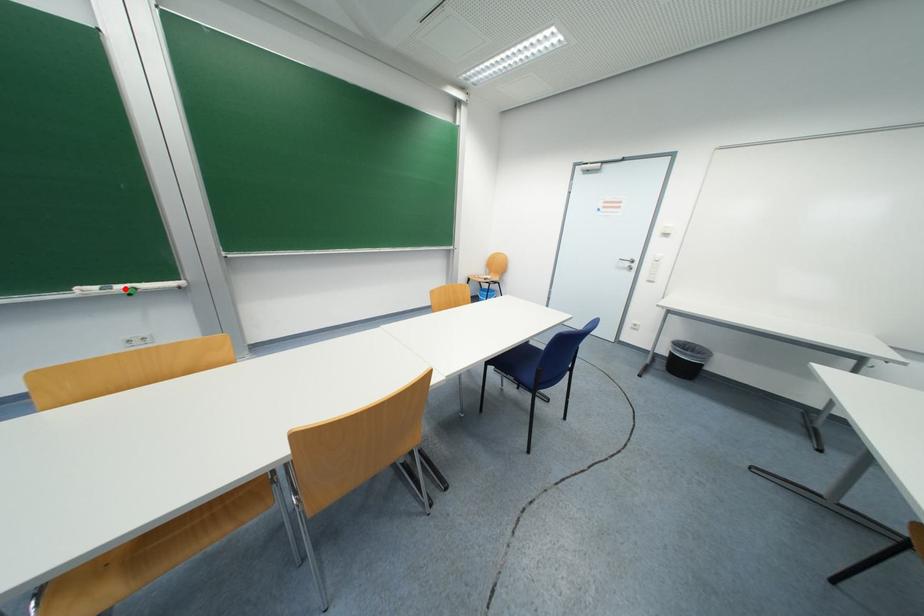
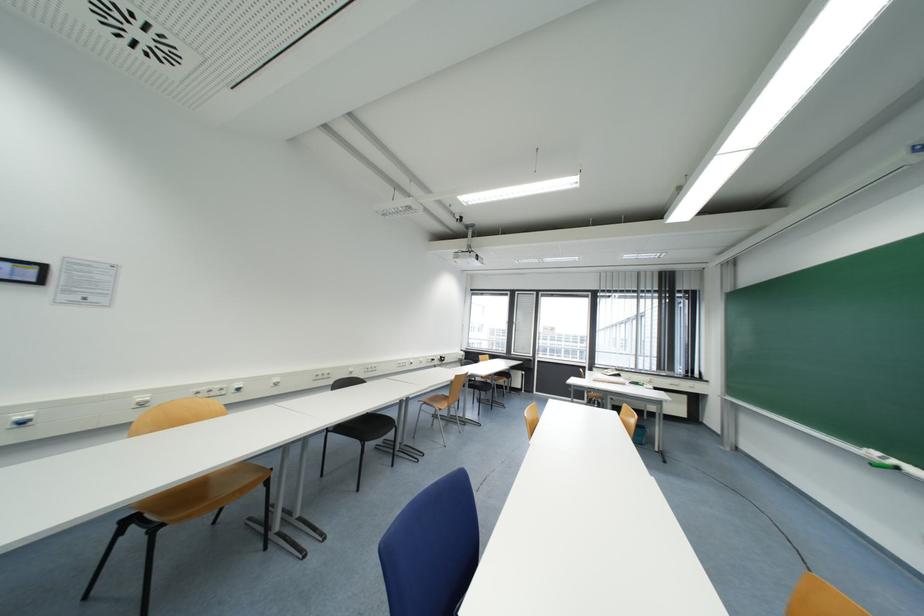
Question: I am providing you with two images of the same scene from different viewpoints. In image1, a red point is highlighted. Considering the same 3D point in image2, which of the following is correct?

Choices:
 (A) It is closer
 (B) It is farther

Answer: (A)